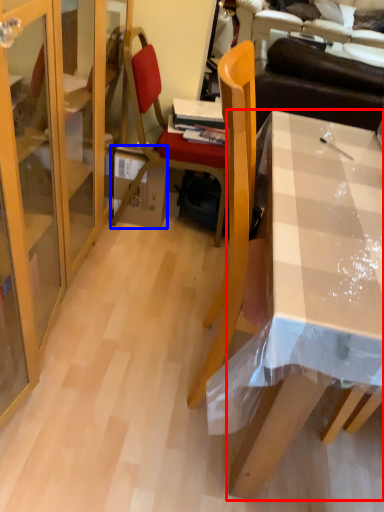
Question: Which point is closer to the camera, desk (highlighted by a red box) or box (highlighted by a blue box)?

Choices:
 (A) desk
 (B) box

Answer: (A)